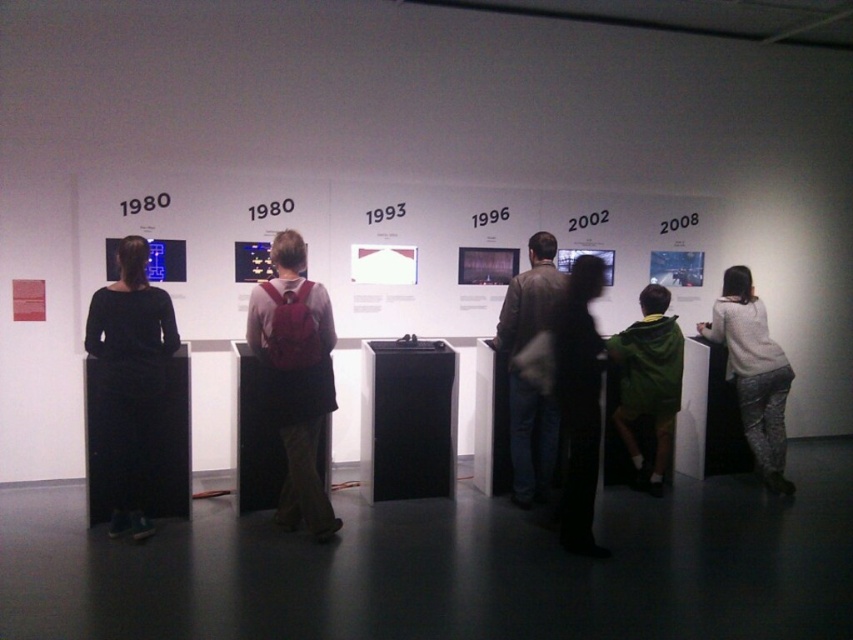
Locate an element on the screen. white sweater at right is located at coordinates tap(753, 372).

Who is more distant from viewer, (x=753, y=400) or (x=645, y=364)?

Point (x=753, y=400)

The image size is (853, 640). What are the coordinates of `white sweater at right` in the screenshot? It's located at (753, 372).

Which is more to the right, leather jacket at center or white sweater at right?

Positioned to the right is white sweater at right.

Between leather jacket at center and white sweater at right, which one has less height?

With less height is white sweater at right.

Who is more distant from viewer, (511, 292) or (770, 372)?

Point (770, 372)

The image size is (853, 640). I want to click on leather jacket at center, so click(x=526, y=380).

Is dark fabric dress at center to the right of green hoodie at center from the viewer's perspective?

In fact, dark fabric dress at center is to the left of green hoodie at center.

Who is taller, dark fabric dress at center or green hoodie at center?

dark fabric dress at center

Which is in front, point (584, 518) or point (648, 323)?

Point (584, 518) is in front.

Locate an element on the screen. The height and width of the screenshot is (640, 853). dark fabric dress at center is located at coordinates (578, 403).